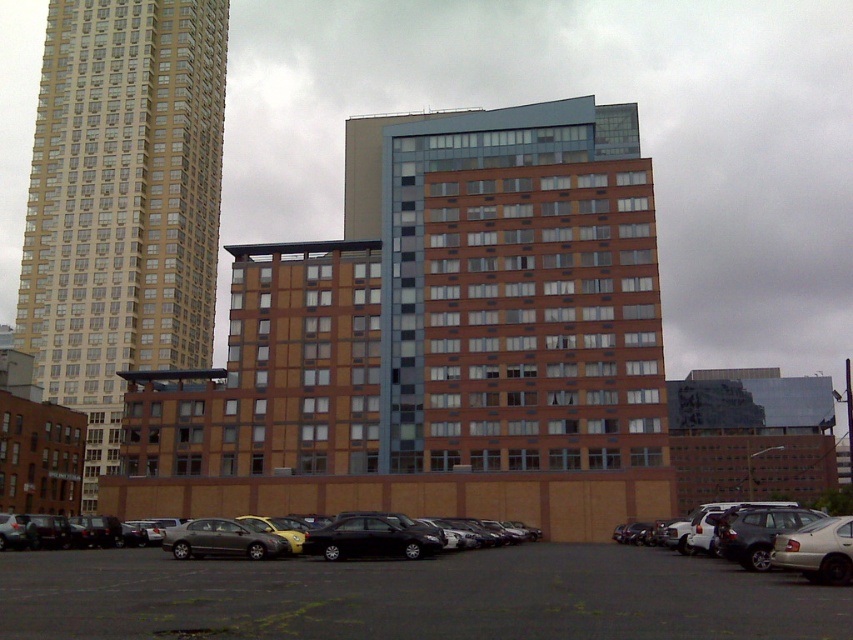
You are a delivery person needing to park your black matte car at lower center in the black asphalt parking lot at lower center. Given that the parking space is 20 feet wide, can your car fit into the space?

The black asphalt parking lot at lower center and black matte car at lower center are 23.17 feet apart. Since the parking space is only 20 feet wide, the car is 3.17 feet too long to fit into the space.

You are standing at the entrance of the tall light colored skyscraper on the left and want to reach the black asphalt parking lot at lower center. Which direction should you head towards?

The black asphalt parking lot at lower center is located at point (412, 596), so you should head towards the lower center direction to reach it from the entrance of the tall light colored skyscraper on the left.

You are a delivery driver approaching the matte gold building at left and the silver metallic suv at lower right. Which object will you reach first?

You will reach the matte gold building at left first because it is closer to you than the silver metallic suv at lower right, which is further away.